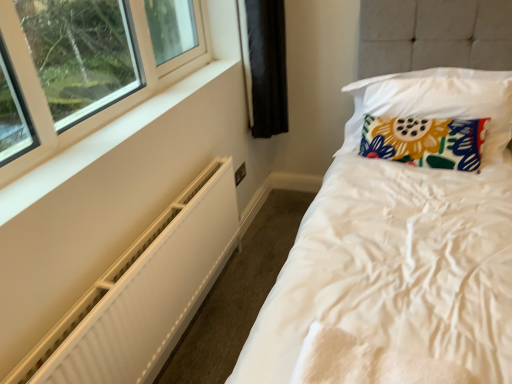
Question: Relative to floral fabric pillow at upper right, which ranks as the second pillow in bottom-to-top order, is white textured radiator at lower left in front or behind?

Choices:
 (A) front
 (B) behind

Answer: (A)

Question: From a real-world perspective, is white textured radiator at lower left above or below floral fabric pillow at upper right, which is the first pillow from top to bottom?

Choices:
 (A) above
 (B) below

Answer: (B)

Question: Considering the real-world distances, which object is closest to the floral fabric pillow at upper right, arranged as the first pillow when ordered from the bottom?

Choices:
 (A) floral fabric pillow at upper right, which ranks as the second pillow in bottom-to-top order
 (B) white textured radiator at lower left

Answer: (A)

Question: Which of these objects is positioned farthest from the white textured radiator at lower left?

Choices:
 (A) floral fabric pillow at upper right, which is the first pillow from top to bottom
 (B) floral fabric pillow at upper right, arranged as the first pillow when ordered from the bottom

Answer: (A)